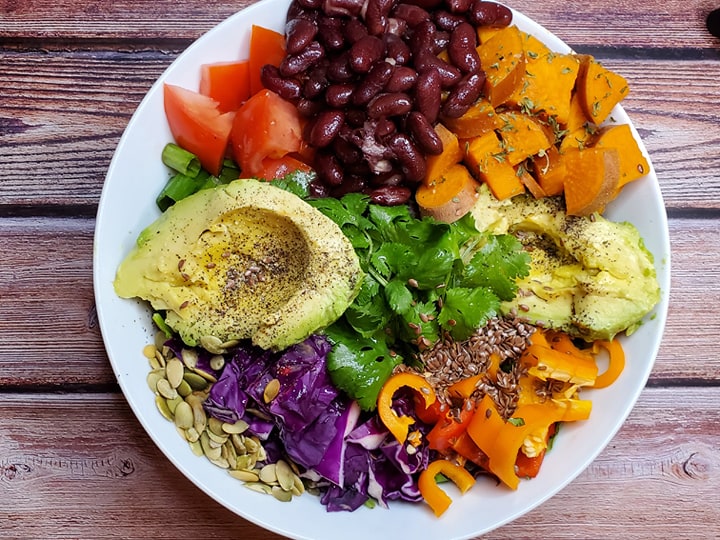
The height and width of the screenshot is (540, 720). Find the location of `knot in wood`. knot in wood is located at coordinates (700, 469), (16, 471), (126, 468).